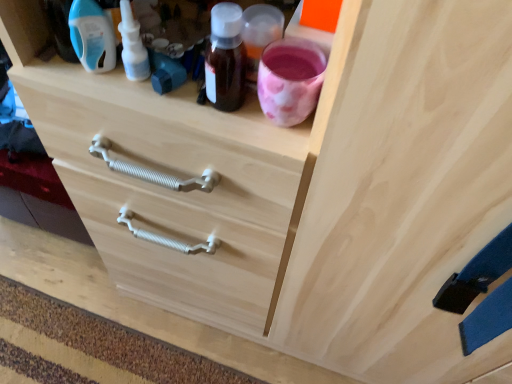
Question: In terms of width, does natural wood drawer at center look wider or thinner when compared to blue plastic bottle at upper left, which ranks as the 1th bottle in left-to-right order?

Choices:
 (A) wide
 (B) thin

Answer: (A)

Question: In terms of height, does natural wood drawer at center look taller or shorter compared to blue plastic bottle at upper left, which ranks as the 1th bottle in left-to-right order?

Choices:
 (A) short
 (B) tall

Answer: (A)

Question: Considering the real-world distances, which object is farthest from the natural wood drawer at center?

Choices:
 (A) white plastic nasal spray at upper left, acting as the first bottle starting from the right
 (B) blue plastic bottle at upper left, which ranks as the 1th bottle in left-to-right order

Answer: (B)

Question: Estimate the real-world distances between objects in this image. Which object is farther from the blue plastic bottle at upper left, which ranks as the 1th bottle in left-to-right order?

Choices:
 (A) natural wood drawer at center
 (B) white plastic nasal spray at upper left, the 2th bottle viewed from the left

Answer: (A)